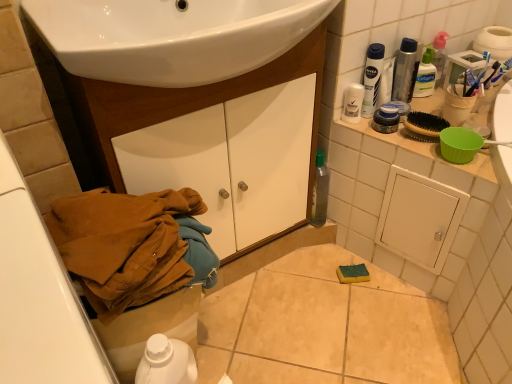
Question: Can you see wooden cabinet at lower left touching white plastic toilet bowl at lower left?

Choices:
 (A) yes
 (B) no

Answer: (B)

Question: Does wooden cabinet at lower left have a greater width compared to white plastic toilet bowl at lower left?

Choices:
 (A) yes
 (B) no

Answer: (A)

Question: From a real-world perspective, is wooden cabinet at lower left located beneath white plastic toilet bowl at lower left?

Choices:
 (A) yes
 (B) no

Answer: (B)

Question: Considering the relative positions of wooden cabinet at lower left and white plastic toilet bowl at lower left in the image provided, is wooden cabinet at lower left to the right of white plastic toilet bowl at lower left from the viewer's perspective?

Choices:
 (A) no
 (B) yes

Answer: (B)

Question: From a real-world perspective, is wooden cabinet at lower left on top of white plastic toilet bowl at lower left?

Choices:
 (A) yes
 (B) no

Answer: (A)

Question: Can you confirm if wooden cabinet at lower left is shorter than white plastic toilet bowl at lower left?

Choices:
 (A) yes
 (B) no

Answer: (B)

Question: Considering the relative sizes of white plastic toilet bowl at lower left and translucent plastic pump bottle at upper right in the image provided, is white plastic toilet bowl at lower left taller than translucent plastic pump bottle at upper right?

Choices:
 (A) no
 (B) yes

Answer: (B)

Question: From a real-world perspective, is white plastic toilet bowl at lower left physically above translucent plastic pump bottle at upper right?

Choices:
 (A) yes
 (B) no

Answer: (B)

Question: Is white plastic toilet bowl at lower left wider than translucent plastic pump bottle at upper right?

Choices:
 (A) no
 (B) yes

Answer: (B)

Question: Is white plastic toilet bowl at lower left positioned beyond the bounds of translucent plastic pump bottle at upper right?

Choices:
 (A) yes
 (B) no

Answer: (A)

Question: Is white plastic toilet bowl at lower left thinner than translucent plastic pump bottle at upper right?

Choices:
 (A) no
 (B) yes

Answer: (A)

Question: Is white plastic toilet bowl at lower left at the right side of translucent plastic pump bottle at upper right?

Choices:
 (A) yes
 (B) no

Answer: (B)

Question: Is blue plastic toothbrush at upper right outside of white plastic bottle at upper right, which ranks as the 1th mouthwash in top-to-bottom order?

Choices:
 (A) no
 (B) yes

Answer: (B)